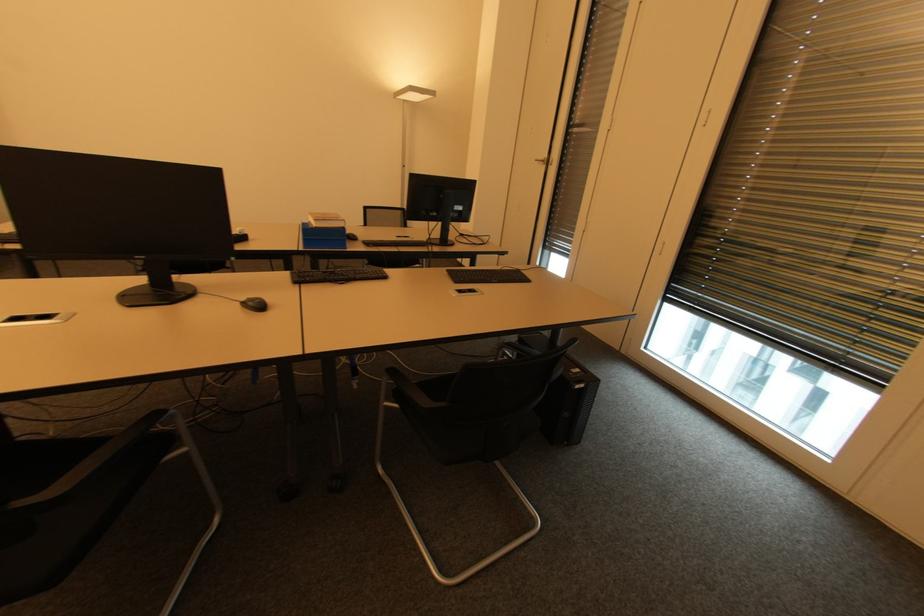
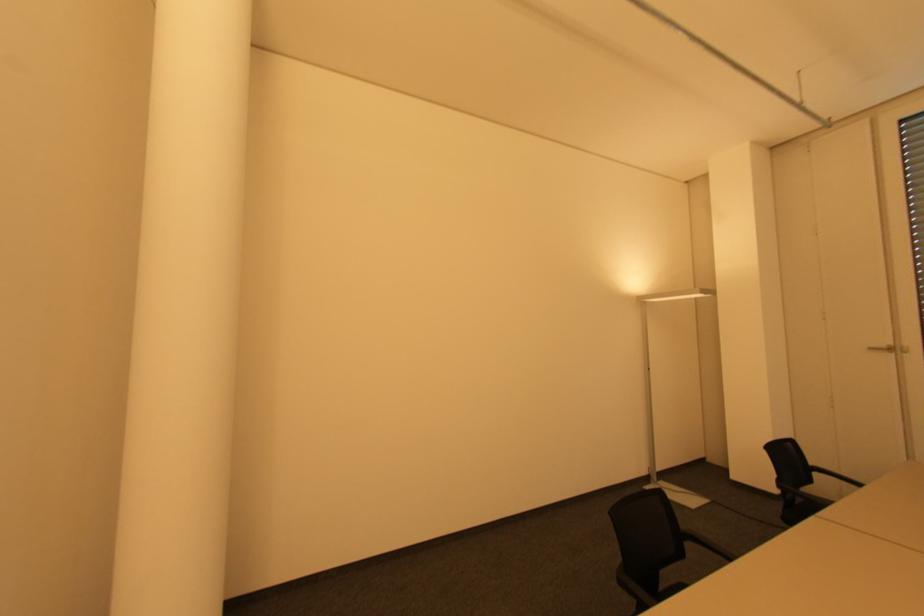
Question: In a continuous first-person perspective shot, in which direction is the camera moving?

Choices:
 (A) Left
 (B) Right
 (C) Forward
 (D) Backward

Answer: (A)